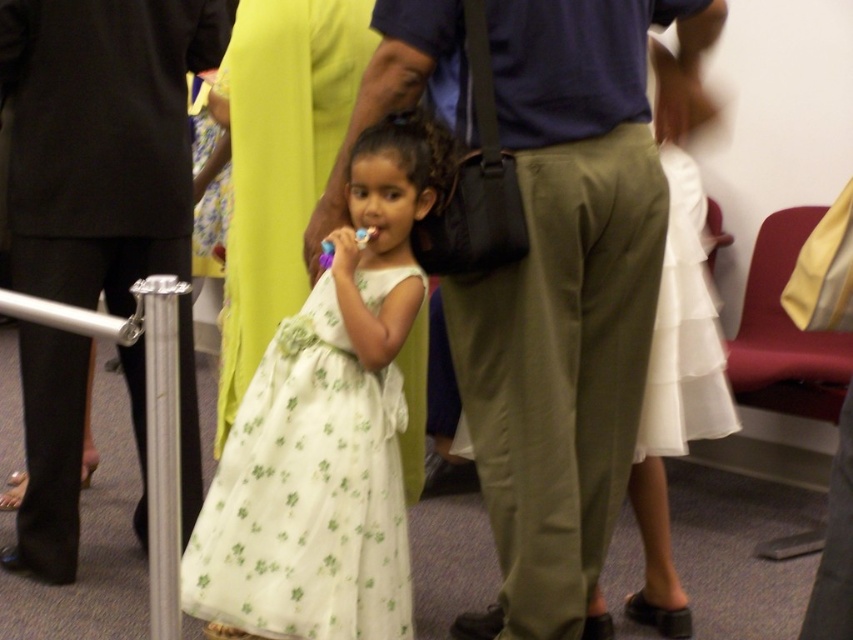
Does point (183, 368) come behind point (378, 230)?

Yes, point (183, 368) is farther from viewer.

Does black fabric pants at lower left appear over matte plastic toothbrush at center?

No, black fabric pants at lower left is not above matte plastic toothbrush at center.

Is point (173, 193) closer to camera compared to point (366, 228)?

No, (173, 193) is further to viewer.

Identify the location of black fabric pants at lower left. (102, 140).

What do you see at coordinates (326, 429) in the screenshot? The image size is (853, 640). I see `white floral dress at center` at bounding box center [326, 429].

Can you confirm if white floral dress at center is thinner than white satin dress at center?

No, white floral dress at center is not thinner than white satin dress at center.

Is point (316, 433) less distant than point (653, 419)?

Yes.

You are a GUI agent. You are given a task and a screenshot of the screen. Output one action in this format:
    pyautogui.click(x=<x>, y=<y>)
    Task: Click on the white floral dress at center
    This screenshot has width=853, height=640.
    Given the screenshot: What is the action you would take?
    pyautogui.click(x=326, y=429)

Is matte olive green pants at center taller than matte plastic toothbrush at center?

Correct, matte olive green pants at center is much taller as matte plastic toothbrush at center.

Between matte olive green pants at center and matte plastic toothbrush at center, which one appears on the left side from the viewer's perspective?

From the viewer's perspective, matte plastic toothbrush at center appears more on the left side.

Which is behind, point (560, 264) or point (366, 236)?

Point (366, 236)

The height and width of the screenshot is (640, 853). I want to click on matte olive green pants at center, so click(567, 292).